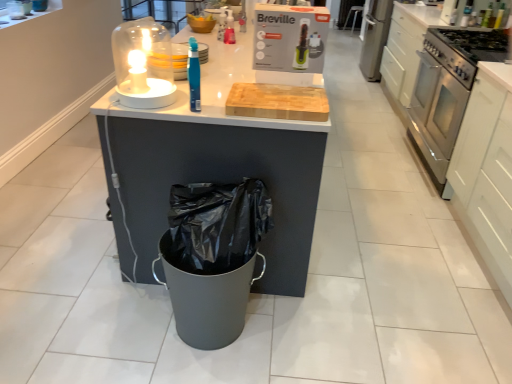
Question: Is stainless steel oven at right turned away from metallic silver bar stool at center?

Choices:
 (A) yes
 (B) no

Answer: (B)

Question: From the image's perspective, is stainless steel oven at right beneath metallic silver bar stool at center?

Choices:
 (A) yes
 (B) no

Answer: (A)

Question: Is stainless steel oven at right positioned beyond the bounds of metallic silver bar stool at center?

Choices:
 (A) no
 (B) yes

Answer: (B)

Question: Does stainless steel oven at right touch metallic silver bar stool at center?

Choices:
 (A) yes
 (B) no

Answer: (B)

Question: From the image's perspective, is stainless steel oven at right on top of metallic silver bar stool at center?

Choices:
 (A) no
 (B) yes

Answer: (A)

Question: In terms of size, does stainless steel gas stove at right appear bigger or smaller than translucent blue toothbrush at center?

Choices:
 (A) small
 (B) big

Answer: (B)

Question: Is stainless steel gas stove at right inside the boundaries of translucent blue toothbrush at center, or outside?

Choices:
 (A) outside
 (B) inside

Answer: (A)

Question: From the image's perspective, relative to translucent blue toothbrush at center, is stainless steel gas stove at right above or below?

Choices:
 (A) below
 (B) above

Answer: (B)

Question: Considering their positions, is stainless steel gas stove at right located in front of or behind translucent blue toothbrush at center?

Choices:
 (A) behind
 (B) front

Answer: (A)

Question: From a real-world perspective, is translucent blue toothbrush at center physically located above or below stainless steel gas stove at right?

Choices:
 (A) above
 (B) below

Answer: (A)

Question: Is point (188, 41) positioned closer to the camera than point (466, 34)?

Choices:
 (A) closer
 (B) farther

Answer: (A)

Question: Looking at their shapes, would you say translucent blue toothbrush at center is wider or thinner than stainless steel gas stove at right?

Choices:
 (A) thin
 (B) wide

Answer: (A)

Question: Would you say translucent blue toothbrush at center is inside or outside stainless steel gas stove at right?

Choices:
 (A) outside
 (B) inside

Answer: (A)

Question: Considering the positions of point (505, 36) and point (194, 41), is point (505, 36) closer or farther from the camera than point (194, 41)?

Choices:
 (A) farther
 (B) closer

Answer: (A)

Question: In the image, is stainless steel oven at right positioned in front of or behind translucent blue toothbrush at center?

Choices:
 (A) behind
 (B) front

Answer: (A)